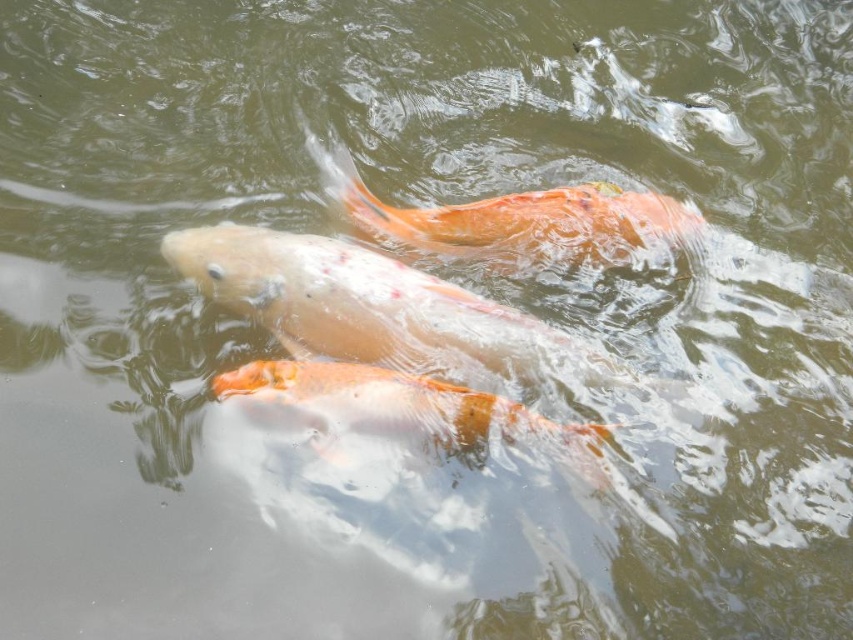
Question: Does orange glossy fish at center appear on the left side of orange glossy goldfish at center?

Choices:
 (A) yes
 (B) no

Answer: (A)

Question: Which object is the closest to the speckled orange fish at center?

Choices:
 (A) orange glossy fish at center
 (B) orange glossy goldfish at center

Answer: (A)

Question: Does speckled orange fish at center have a lesser width compared to orange glossy fish at center?

Choices:
 (A) no
 (B) yes

Answer: (A)

Question: Which point is farther from the camera taking this photo?

Choices:
 (A) (479, 211)
 (B) (538, 355)

Answer: (A)

Question: Is speckled orange fish at center to the right of orange glossy fish at center from the viewer's perspective?

Choices:
 (A) no
 (B) yes

Answer: (B)

Question: Which point is farther from the camera taking this photo?

Choices:
 (A) (227, 264)
 (B) (431, 220)

Answer: (B)